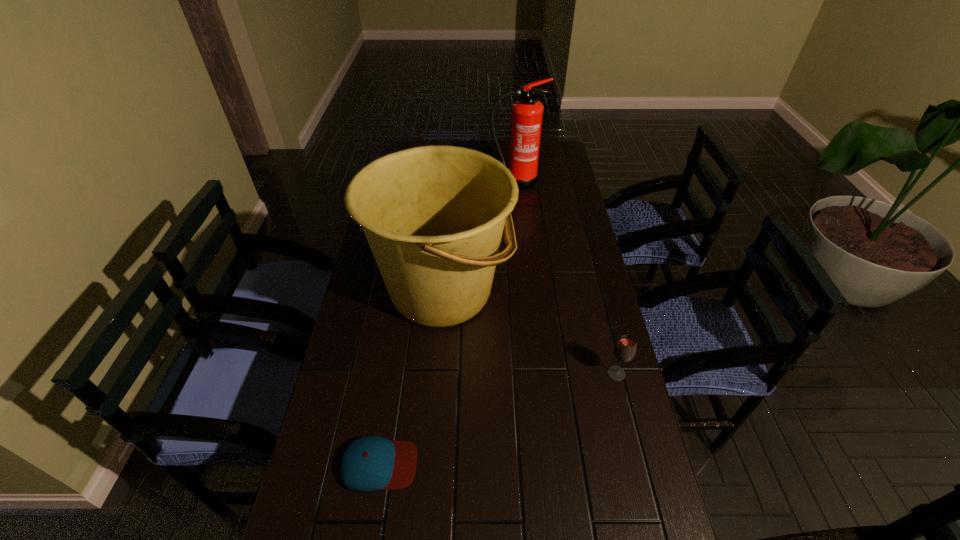
Identify the location of vacant area that lies between the glass drink container and the fire extinguisher. (565, 277).

Image resolution: width=960 pixels, height=540 pixels. Identify the location of free space between the third nearest object and the rightmost object. (529, 332).

Identify the location of free point between the glass drink container and the second farthest object. The width and height of the screenshot is (960, 540). (529, 332).

What are the coordinates of `vacant area that lies between the second shortest object and the bucket` in the screenshot? It's located at (529, 332).

The width and height of the screenshot is (960, 540). I want to click on the third closest object to the fire extinguisher, so click(369, 463).

Find the location of a particular element. The image size is (960, 540). the second closest object to the second shortest object is located at coordinates (369, 463).

Where is `vacant area that satisfies the following two spatial constraints: 1. on the side of the glass drink container with the handle; 2. on the right side of the bucket`? vacant area that satisfies the following two spatial constraints: 1. on the side of the glass drink container with the handle; 2. on the right side of the bucket is located at coordinates (435, 374).

Find the location of a particular element. vacant area in the image that satisfies the following two spatial constraints: 1. at the nozzle of the fire extinguisher; 2. on the left side of the rightmost object is located at coordinates (535, 374).

This screenshot has height=540, width=960. Find the location of `free space that satisfies the following two spatial constraints: 1. on the side of the rightmost object with the handle; 2. on the left side of the second farthest object`. free space that satisfies the following two spatial constraints: 1. on the side of the rightmost object with the handle; 2. on the left side of the second farthest object is located at coordinates (435, 374).

The height and width of the screenshot is (540, 960). In order to click on free location that satisfies the following two spatial constraints: 1. at the nozzle of the second nearest object; 2. on the left side of the fire extinguisher in this screenshot , I will do [535, 374].